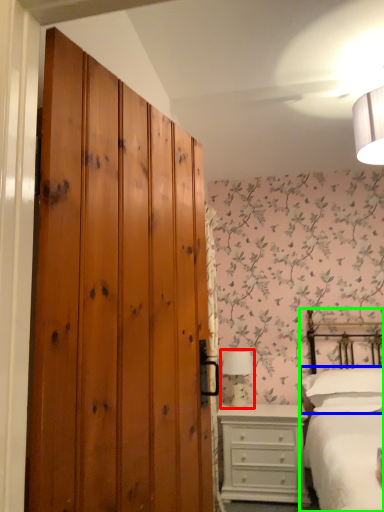
Question: Based on their relative distances, which object is farther from table lamp (highlighted by a red box)? Choose from pillow (highlighted by a blue box) and bed (highlighted by a green box).

Choices:
 (A) pillow
 (B) bed

Answer: (B)